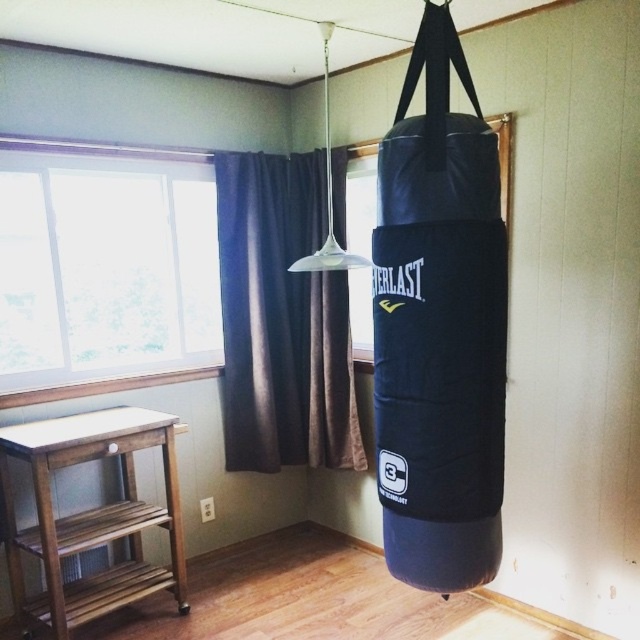
You are standing in the room and want to check if you can reach the transparent glass window at upper left from your current position. The room is 10 feet long. Can you reach it without moving more than 10 feet?

The transparent glass window at upper left is 8.75 feet away from the camera, so yes, you can reach it without moving more than 10 feet since 8.75 is less than 10.

You are a delivery person trying to place a large package in the room. The package is 4 feet wide. You see the transparent glass window at upper left and the transparent glass window at center. Can you fit the package between them?

The transparent glass window at upper left is 3.59 feet from the transparent glass window at center. Since the package is 4 feet wide, it cannot fit between them as the distance is shorter than the package width.

You are designing a new room layout and need to place a large sofa that requires 2 meters of space. You have two options for placement areas in the room described. One area is in front of the dark velvet curtain at center, and the other is in front of the transparent glass window at center. Based on the provided scene description, which area would allow the sofa to fit better?

The dark velvet curtain at center has a greater width than the transparent glass window at center, so placing the sofa in front of the dark velvet curtain at center would provide more space for the sofa to fit better.